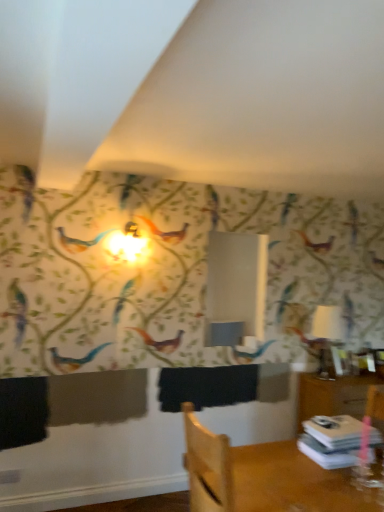
Question: From the image's perspective, is wooden chair at lower right located beneath white glossy table lamp at right?

Choices:
 (A) yes
 (B) no

Answer: (A)

Question: Is the position of wooden chair at lower right more distant than that of white glossy table lamp at right?

Choices:
 (A) yes
 (B) no

Answer: (B)

Question: From the image's perspective, is wooden chair at lower right on top of white glossy table lamp at right?

Choices:
 (A) no
 (B) yes

Answer: (A)

Question: Is white glossy table lamp at right surrounded by wooden chair at lower right?

Choices:
 (A) yes
 (B) no

Answer: (B)

Question: Is the position of wooden chair at lower right less distant than that of white glossy table lamp at right?

Choices:
 (A) yes
 (B) no

Answer: (A)

Question: Is wooden chair at lower right looking in the opposite direction of white glossy table lamp at right?

Choices:
 (A) yes
 (B) no

Answer: (B)

Question: Is wooden chair at lower right turned away from white paper stack at lower right?

Choices:
 (A) no
 (B) yes

Answer: (A)

Question: Are wooden chair at lower right and white paper stack at lower right beside each other?

Choices:
 (A) yes
 (B) no

Answer: (B)

Question: Considering the relative sizes of wooden chair at lower right and white paper stack at lower right in the image provided, is wooden chair at lower right thinner than white paper stack at lower right?

Choices:
 (A) no
 (B) yes

Answer: (A)

Question: From a real-world perspective, is wooden chair at lower right beneath white paper stack at lower right?

Choices:
 (A) yes
 (B) no

Answer: (A)

Question: Is wooden chair at lower right surrounding white paper stack at lower right?

Choices:
 (A) yes
 (B) no

Answer: (B)

Question: Is wooden chair at lower right outside white paper stack at lower right?

Choices:
 (A) no
 (B) yes

Answer: (B)

Question: Is the depth of white glossy table lamp at right greater than that of white paper stack at lower right?

Choices:
 (A) no
 (B) yes

Answer: (B)